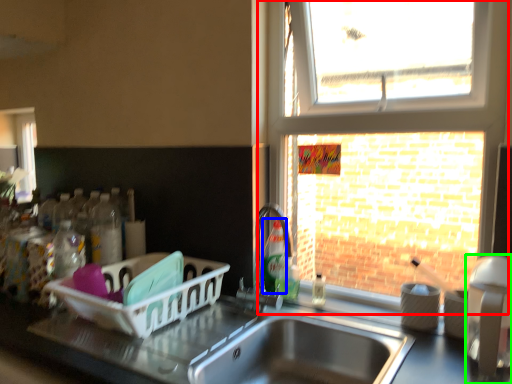
Question: Based on their relative distances, which object is farther from window (highlighted by a red box)? Choose from bottle (highlighted by a blue box) and appliance (highlighted by a green box).

Choices:
 (A) bottle
 (B) appliance

Answer: (B)